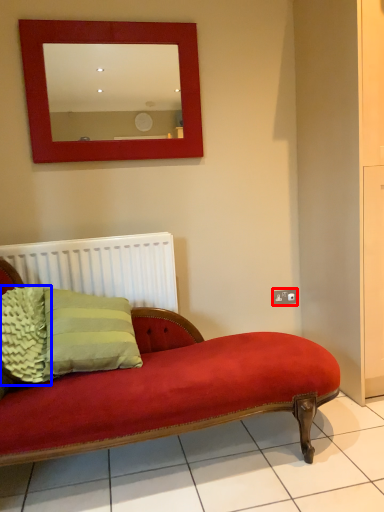
Question: Which point is further to the camera, electric outlet (highlighted by a red box) or pillow (highlighted by a blue box)?

Choices:
 (A) electric outlet
 (B) pillow

Answer: (A)